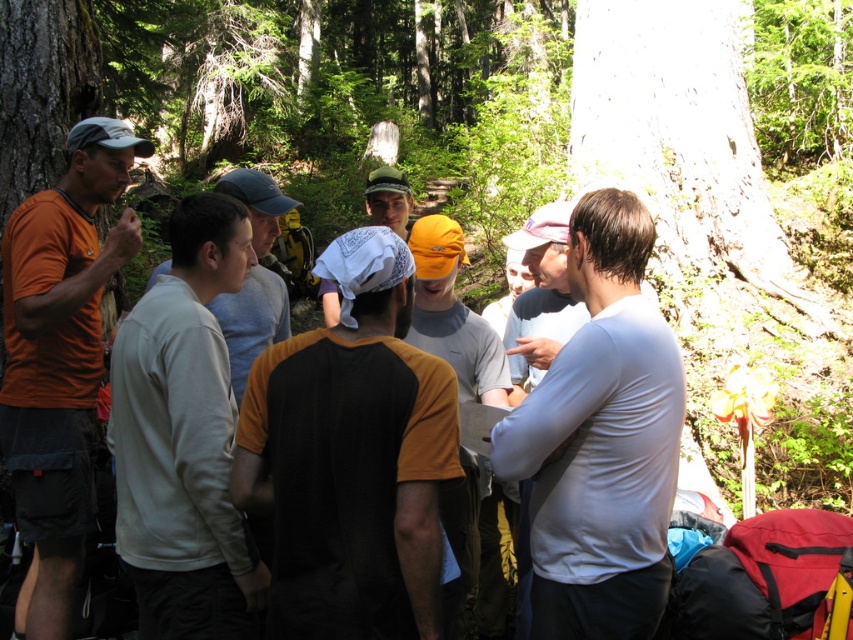
You are a photographer trying to capture a group photo of the black jersey at center and the orange fabric cap at center. Which object should you focus on first if you want to ensure both are in frame without moving the camera?

The black jersey at center has a larger width than the orange fabric cap at center, so focusing on the black jersey at center first will help ensure both are in frame without needing to adjust the camera position.

You are a photographer trying to capture a candid shot of the group. You notice the white fleece shirt at center and a camera in the scene. How far apart are these two items?

→ The white fleece shirt at center and the camera are 8.17 feet apart from each other.

You are a photographer trying to capture a closeup of the white smooth shirt at center. Based on its position, which direction should you move to get a better shot?

You should move towards the center of the scene to capture a closeup of the white smooth shirt at center since it is located at point (x=601, y=440).